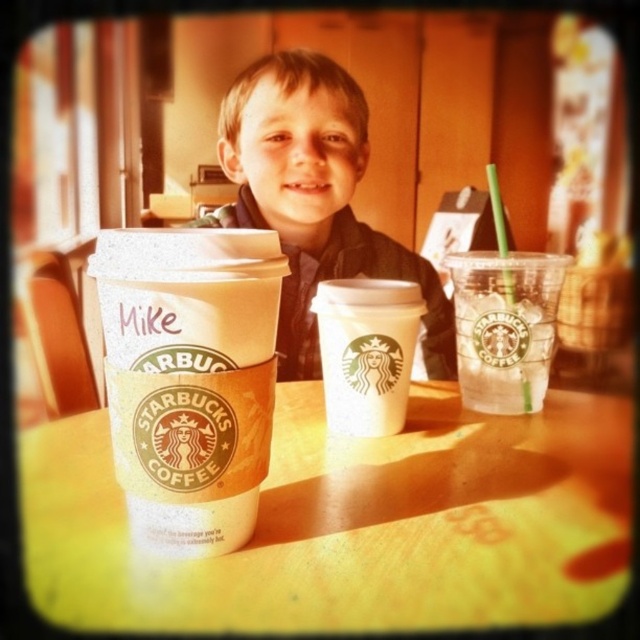
Which is more to the left, yellow matte table at center or white paper cup at center?

white paper cup at center

Who is lower down, yellow matte table at center or white paper cup at center?

yellow matte table at center is below.

Find the location of a particular element. The width and height of the screenshot is (640, 640). yellow matte table at center is located at coordinates pyautogui.click(x=355, y=524).

This screenshot has width=640, height=640. In order to click on yellow matte table at center in this screenshot , I will do `click(355, 524)`.

Between point (451, 572) and point (337, 72), which one is positioned in front?

Point (451, 572) is in front.

Which is in front, point (54, 588) or point (308, 163)?

Point (54, 588) is more forward.

What are the coordinates of `yellow matte table at center` in the screenshot? It's located at (355, 524).

Who is more forward, (x=540, y=401) or (x=342, y=349)?

Positioned in front is point (x=342, y=349).

Describe the element at coordinates (504, 326) in the screenshot. I see `clear plastic cup at center right` at that location.

Does point (465, 404) come farther from viewer compared to point (349, 404)?

That is True.

Image resolution: width=640 pixels, height=640 pixels. In order to click on clear plastic cup at center right in this screenshot , I will do `click(504, 326)`.